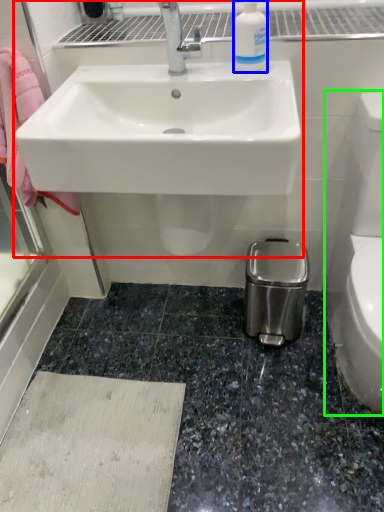
Question: Which is farther away from sink (highlighted by a red box)? cleaning product (highlighted by a blue box) or toilet bowl (highlighted by a green box)?

Choices:
 (A) cleaning product
 (B) toilet bowl

Answer: (B)